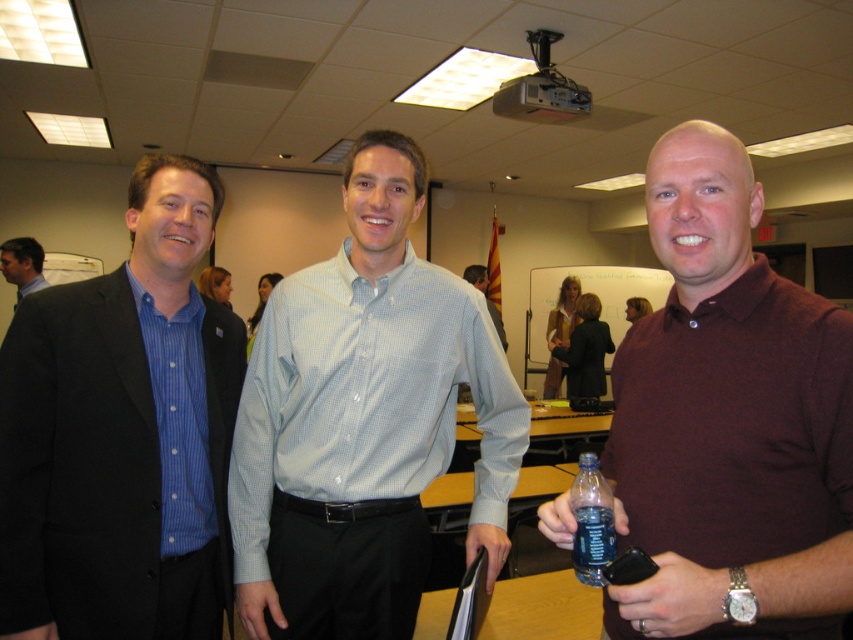
You are organizing a meeting and need to place a name tag on the table. The name tag is 10 cm wide. There is a translucent plastic bottle at center and a brushed metal suit at left. Can you fit the name tag between them?

The translucent plastic bottle at center is positioned on the right side of brushed metal suit at left, so there is space between them. The name tag, being 10 cm wide, can fit between the two items as long as the distance between them is at least 10 cm. However, the exact distance isn not provided, so it depends on the actual spacing available.

You are standing in the conference room and need to address the person closest to the front. Which individual should you approach, the matte black suit at left or the matte burgundy polo shirt at right?

The matte black suit at left is in front of the matte burgundy polo shirt at right, so you should approach the matte black suit at left as they are closer to the front.